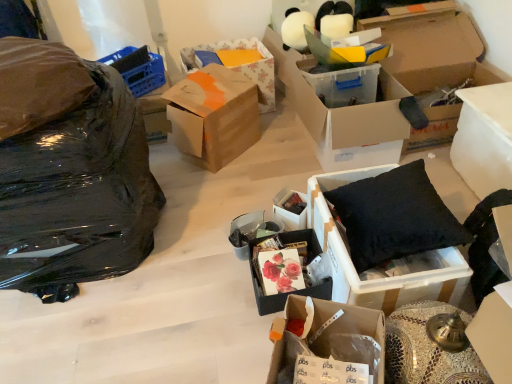
At what (x,y) coordinates should I click in order to perform the action: click on free spot behind matte black box at center, placed as the 4th box when sorted from left to right. Please return your answer as a coordinate pair (x, y). This screenshot has width=512, height=384. Looking at the image, I should click on (279, 191).